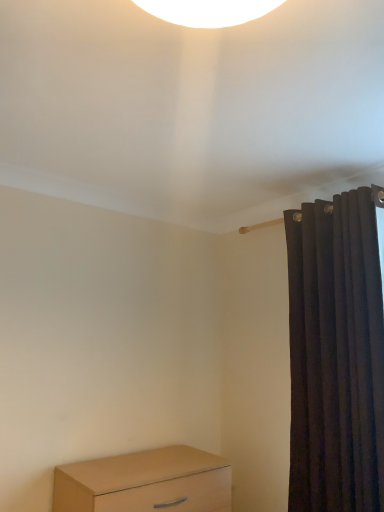
Image resolution: width=384 pixels, height=512 pixels. What do you see at coordinates (336, 355) in the screenshot?
I see `dark velvet curtain at right` at bounding box center [336, 355].

Find the location of a particular element. This screenshot has height=512, width=384. dark velvet curtain at right is located at coordinates (336, 355).

Locate an element on the screen. light brown wood chest of drawers at lower left is located at coordinates (145, 482).

Describe the element at coordinates (145, 482) in the screenshot. I see `light brown wood chest of drawers at lower left` at that location.

Identify the location of dark velvet curtain at right. The width and height of the screenshot is (384, 512). (336, 355).

Which object is positioned more to the right, light brown wood chest of drawers at lower left or dark velvet curtain at right?

dark velvet curtain at right.

Between light brown wood chest of drawers at lower left and dark velvet curtain at right, which one is positioned behind?

light brown wood chest of drawers at lower left is behind.

Is point (72, 474) in front of point (372, 478)?

No, it is not.

From the image's perspective, which is above, light brown wood chest of drawers at lower left or dark velvet curtain at right?

From the image's view, dark velvet curtain at right is above.

From a real-world perspective, which object stands above the other?

From a 3D spatial view, dark velvet curtain at right is above.

Considering the sizes of light brown wood chest of drawers at lower left and dark velvet curtain at right in the image, is light brown wood chest of drawers at lower left wider or thinner than dark velvet curtain at right?

light brown wood chest of drawers at lower left is wider than dark velvet curtain at right.

Who is shorter, light brown wood chest of drawers at lower left or dark velvet curtain at right?

With less height is light brown wood chest of drawers at lower left.

Which of these two, light brown wood chest of drawers at lower left or dark velvet curtain at right, is smaller?

light brown wood chest of drawers at lower left.

Can we say light brown wood chest of drawers at lower left lies outside dark velvet curtain at right?

light brown wood chest of drawers at lower left lies outside dark velvet curtain at right's area.

Are light brown wood chest of drawers at lower left and dark velvet curtain at right making contact?

No, light brown wood chest of drawers at lower left is not making contact with dark velvet curtain at right.

Is light brown wood chest of drawers at lower left positioned with its back to dark velvet curtain at right?

No.

How different are the orientations of light brown wood chest of drawers at lower left and dark velvet curtain at right in degrees?

89.5 degrees.

How much distance is there between light brown wood chest of drawers at lower left and dark velvet curtain at right?

light brown wood chest of drawers at lower left is 30.73 inches from dark velvet curtain at right.

Locate an element on the screen. Image resolution: width=384 pixels, height=512 pixels. curtain in front of the light brown wood chest of drawers at lower left is located at coordinates (336, 355).

Is dark velvet curtain at right to the left of light brown wood chest of drawers at lower left from the viewer's perspective?

In fact, dark velvet curtain at right is to the right of light brown wood chest of drawers at lower left.

Does dark velvet curtain at right lie behind light brown wood chest of drawers at lower left?

That is False.

Which is closer to the camera, (365, 239) or (79, 501)?

Point (365, 239).

From the image's perspective, is dark velvet curtain at right on light brown wood chest of drawers at lower left?

Indeed, from the image's perspective, dark velvet curtain at right is shown above light brown wood chest of drawers at lower left.

From a real-world perspective, is dark velvet curtain at right located higher than light brown wood chest of drawers at lower left?

Correct, in the physical world, dark velvet curtain at right is higher than light brown wood chest of drawers at lower left.

Which object is wider, dark velvet curtain at right or light brown wood chest of drawers at lower left?

With larger width is light brown wood chest of drawers at lower left.

Considering the sizes of objects dark velvet curtain at right and light brown wood chest of drawers at lower left in the image provided, who is shorter, dark velvet curtain at right or light brown wood chest of drawers at lower left?

Standing shorter between the two is light brown wood chest of drawers at lower left.

Consider the image. Looking at the image, does dark velvet curtain at right seem bigger or smaller compared to light brown wood chest of drawers at lower left?

In the image, dark velvet curtain at right appears to be larger than light brown wood chest of drawers at lower left.

Is dark velvet curtain at right located outside light brown wood chest of drawers at lower left?

Yes, dark velvet curtain at right is outside of light brown wood chest of drawers at lower left.

Is dark velvet curtain at right placed right next to light brown wood chest of drawers at lower left?

There is a gap between dark velvet curtain at right and light brown wood chest of drawers at lower left.

Does dark velvet curtain at right turn towards light brown wood chest of drawers at lower left?

No, dark velvet curtain at right is not facing towards light brown wood chest of drawers at lower left.

In the scene shown: How many degrees apart are the facing directions of dark velvet curtain at right and light brown wood chest of drawers at lower left?

They differ by 89.5 degrees in their facing directions.

Locate an element on the screen. This screenshot has width=384, height=512. curtain positioned vertically above the light brown wood chest of drawers at lower left (from a real-world perspective) is located at coordinates (336, 355).

Locate an element on the screen. Image resolution: width=384 pixels, height=512 pixels. the chest of drawers located below the dark velvet curtain at right (from the image's perspective) is located at coordinates (145, 482).

This screenshot has height=512, width=384. Find the location of `chest of drawers lying on the left of dark velvet curtain at right`. chest of drawers lying on the left of dark velvet curtain at right is located at coordinates (145, 482).